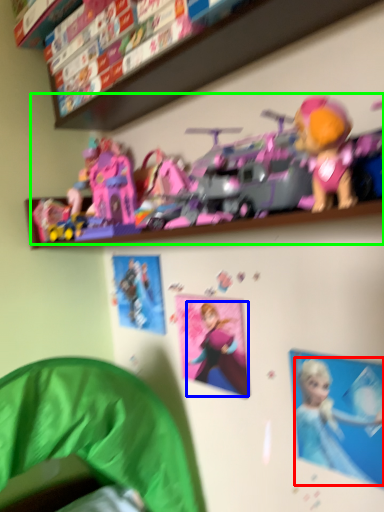
Question: Based on their relative distances, which object is farther from person (highlighted by a red box)? Choose from toy (highlighted by a blue box) and toy (highlighted by a green box).

Choices:
 (A) toy
 (B) toy

Answer: (B)